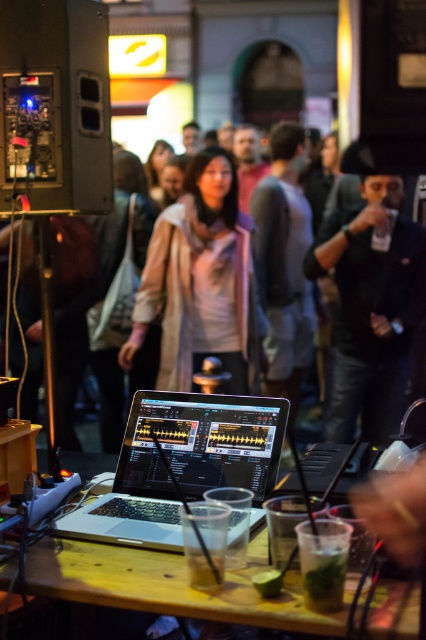
Does black leather jacket at right have a lesser width compared to wooden table at center?

Correct, black leather jacket at right's width is less than wooden table at center's.

Which of these two, black leather jacket at right or wooden table at center, stands taller?

Standing taller between the two is black leather jacket at right.

Who is more distant from viewer, (397, 204) or (402, 636)?

The point (397, 204) is behind.

Where is `black leather jacket at right`? This screenshot has width=426, height=640. black leather jacket at right is located at coordinates (371, 307).

Which is in front, point (388, 348) or point (137, 493)?

Point (137, 493) is in front.

Does point (371, 214) lie behind point (121, 476)?

That is True.

I want to click on black leather jacket at right, so click(x=371, y=307).

Between point (184, 296) and point (233, 570), which one is positioned in front?

Positioned in front is point (233, 570).

Is matte white shirt at center shorter than wooden table at center?

Incorrect, matte white shirt at center's height does not fall short of wooden table at center's.

Between point (193, 240) and point (379, 600), which one is positioned in front?

Positioned in front is point (379, 600).

Where is `matte white shirt at center`? matte white shirt at center is located at coordinates (199, 282).